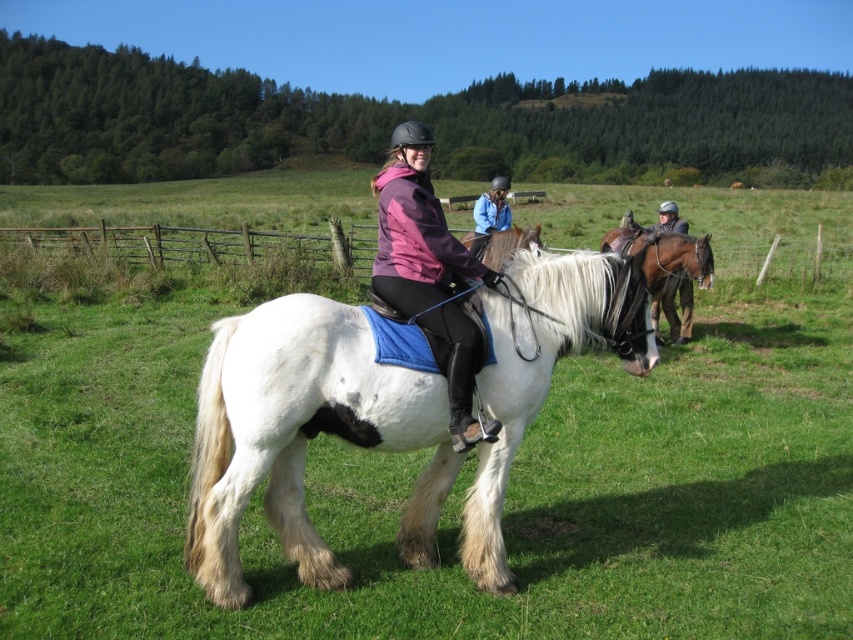
You are standing at the point with coordinates (502,243) in the image. What object is located exactly at this point?

The point at coordinates (502,243) is located exactly at the white shaggy horse at center.

You are planning to set up a picnic blanket in the green grassy field at center. The picnic blanket is 2 meters wide. Can the white soft fur horse at center walk through the remaining space next to the picnic blanket without stepping on it?

The green grassy field at center might be wider than white soft fur horse at center, so there might be enough space for the horse to walk around the picnic blanket. However, since the exact width difference isn not specified, it is uncertain whether the remaining space would be sufficient for the horse to pass without stepping on the blanket.